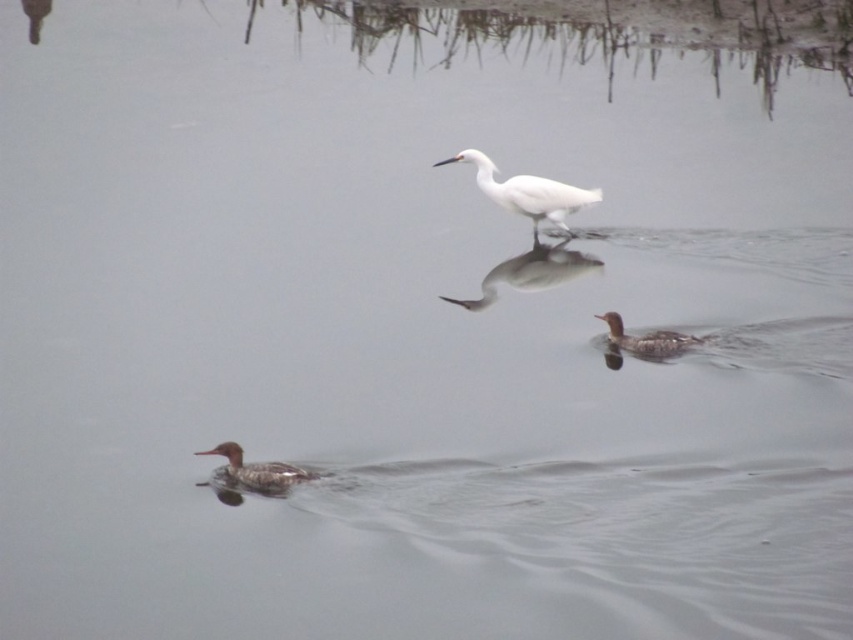
You are a photographer trying to capture a photo of the white matte bird at center and the brown matte duck at lower left. You want to ensure both are in the frame. Based on their positions, which bird should you position your camera closer to in order to include both in the shot?

The white matte bird at center is to the right of the brown matte duck at lower left, so positioning the camera closer to the center would allow both birds to be captured in the frame.